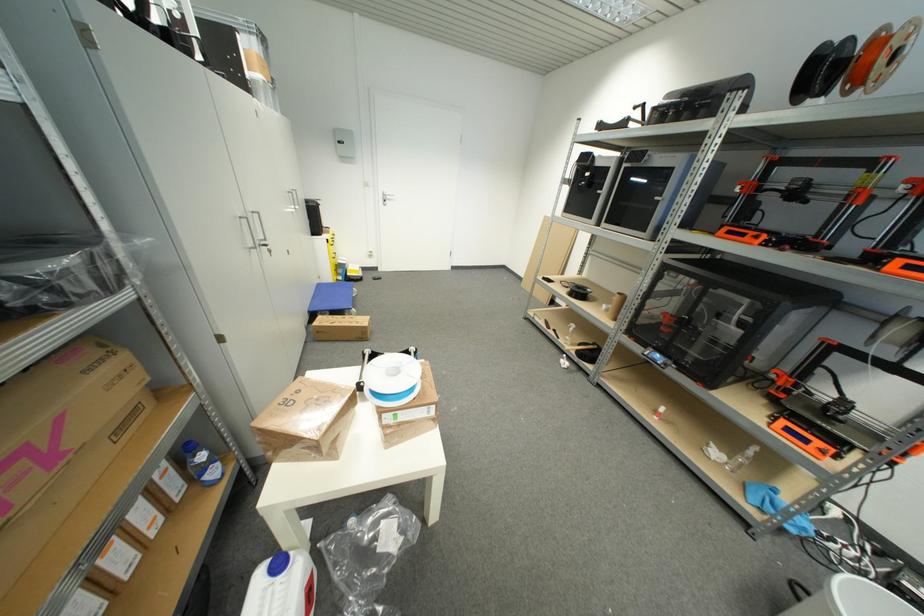
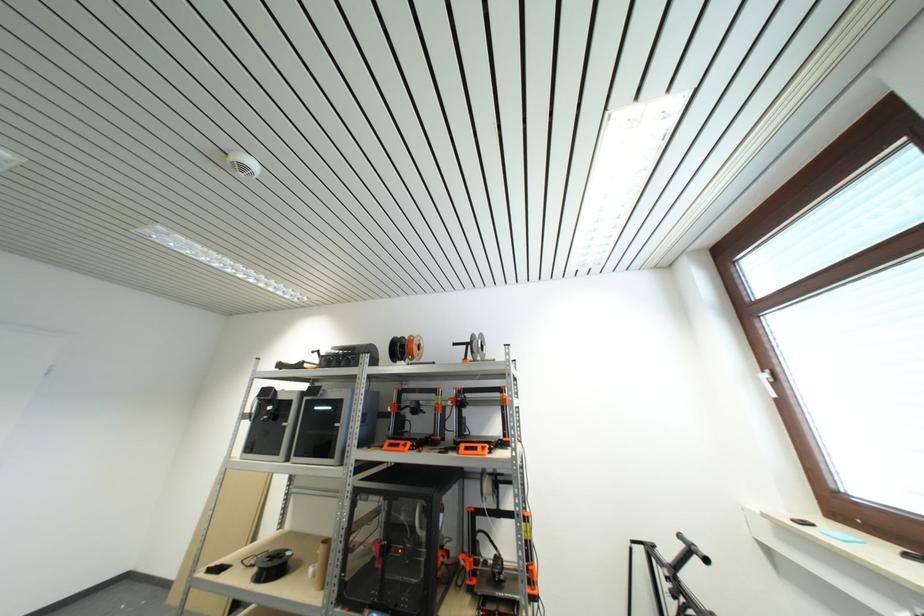
In the second image, find the point that corresponds to point 661,201 in the first image.

(341, 427)